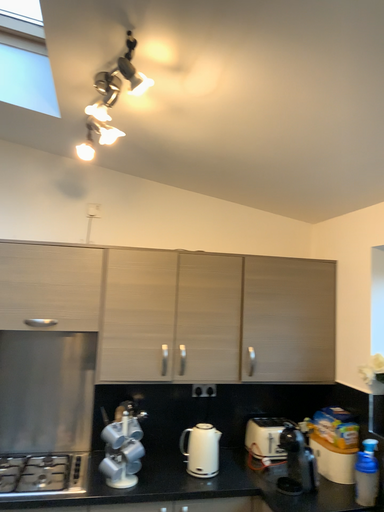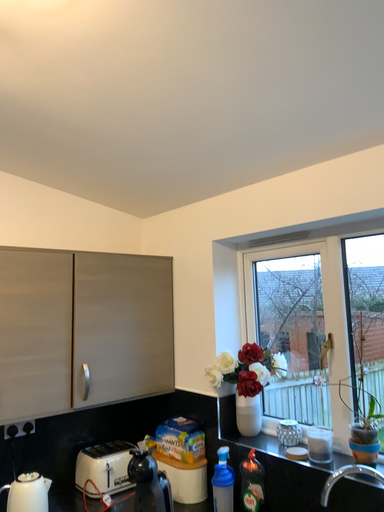
Question: Which way did the camera rotate in the video?

Choices:
 (A) rotated left
 (B) rotated right

Answer: (B)